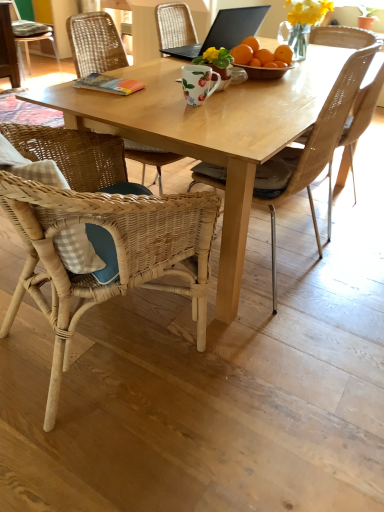
I want to click on free space in front of floral matte coffee cup at center, so click(x=204, y=114).